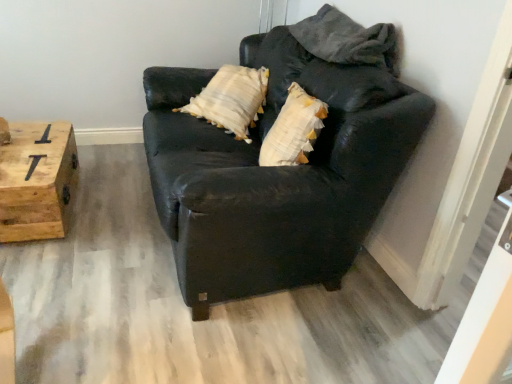
Question: From a real-world perspective, is wooden crate at left physically located above or below matte black couch at center?

Choices:
 (A) below
 (B) above

Answer: (A)

Question: Looking at their shapes, would you say wooden crate at left is wider or thinner than matte black couch at center?

Choices:
 (A) thin
 (B) wide

Answer: (A)

Question: Is wooden crate at left taller or shorter than matte black couch at center?

Choices:
 (A) short
 (B) tall

Answer: (A)

Question: From the image's perspective, is matte black couch at center located above or below wooden crate at left?

Choices:
 (A) above
 (B) below

Answer: (A)

Question: From their relative heights in the image, would you say matte black couch at center is taller or shorter than wooden crate at left?

Choices:
 (A) tall
 (B) short

Answer: (A)

Question: From a real-world perspective, is matte black couch at center above or below wooden crate at left?

Choices:
 (A) above
 (B) below

Answer: (A)

Question: In the image, is matte black couch at center positioned in front of or behind wooden crate at left?

Choices:
 (A) behind
 (B) front

Answer: (B)